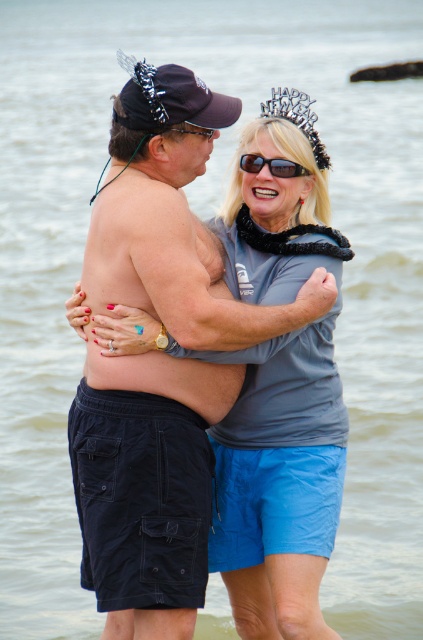
Can you confirm if sunglasses at center is smaller than matte black goggles at center?

No.

Does sunglasses at center have a larger size compared to matte black goggles at center?

Yes, sunglasses at center is bigger than matte black goggles at center.

Between point (282, 173) and point (206, 134), which one is positioned in front?

Point (206, 134) is in front.

What are the coordinates of `sunglasses at center` in the screenshot? It's located at click(x=271, y=164).